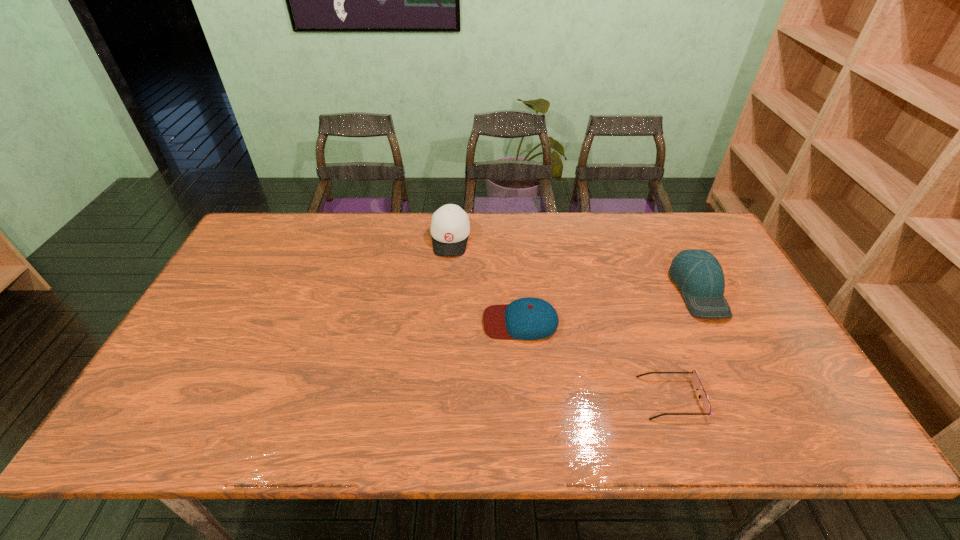
Find the location of a particular element. This screenshot has height=540, width=960. the farthest baseball cap is located at coordinates (450, 227).

The width and height of the screenshot is (960, 540). I want to click on the leftmost object, so click(x=450, y=227).

Where is `the rightmost baseball cap`? The width and height of the screenshot is (960, 540). the rightmost baseball cap is located at coordinates (698, 274).

Locate an element on the screen. the second shortest object is located at coordinates pos(529,318).

Identify the location of the third object from right to left. Image resolution: width=960 pixels, height=540 pixels. (529, 318).

This screenshot has height=540, width=960. Find the location of `the nearest object`. the nearest object is located at coordinates (695, 379).

The width and height of the screenshot is (960, 540). Find the location of `the third object from left to right`. the third object from left to right is located at coordinates (695, 379).

The image size is (960, 540). I want to click on free space located on the front-facing side of the farthest object, so click(x=442, y=349).

Where is `free space located 0.060m on the front of the rightmost object`? This screenshot has width=960, height=540. free space located 0.060m on the front of the rightmost object is located at coordinates (724, 340).

Image resolution: width=960 pixels, height=540 pixels. I want to click on free space located 0.350m with the bill of the second shortest object facing forward, so click(355, 322).